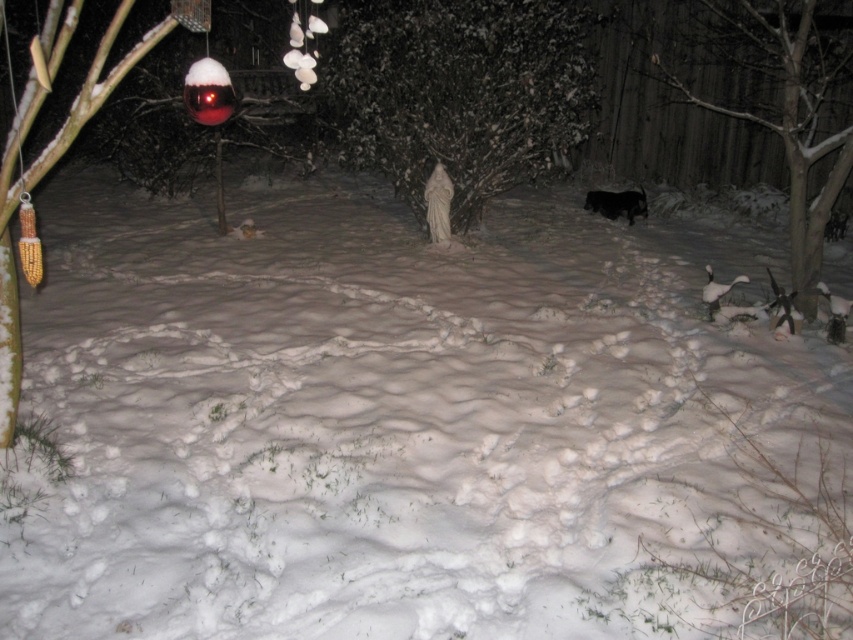
Question: Considering the relative positions of white frosted statue at center and black fur dog at center right in the image provided, where is white frosted statue at center located with respect to black fur dog at center right?

Choices:
 (A) below
 (B) above

Answer: (B)

Question: Among these points, which one is nearest to the camera?

Choices:
 (A) (633, 200)
 (B) (437, 67)
 (C) (764, 40)

Answer: (B)

Question: Is white fluffy snow at center positioned in front of yellow corn cob at left?

Choices:
 (A) no
 (B) yes

Answer: (B)

Question: Estimate the real-world distances between objects in this image. Which object is closer to the white frosted statue at center?

Choices:
 (A) yellow corn cob at left
 (B) black fur dog at center right
 (C) snow-covered tree at right

Answer: (B)

Question: Can you confirm if yellow corn cob at left is wider than black fur dog at center right?

Choices:
 (A) yes
 (B) no

Answer: (A)

Question: Which point is closer to the camera?

Choices:
 (A) (827, 372)
 (B) (631, 195)
 (C) (24, 134)
 (D) (801, 83)

Answer: (C)